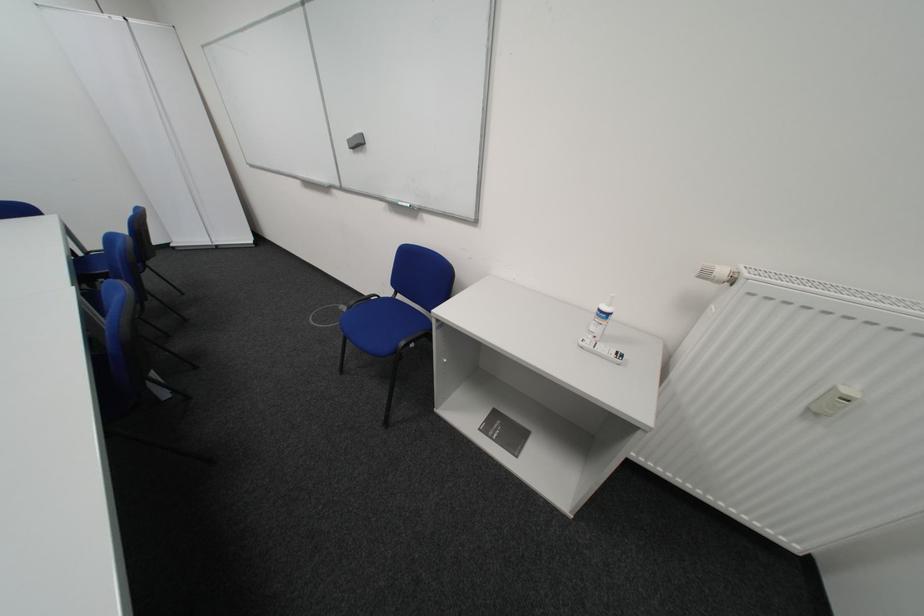
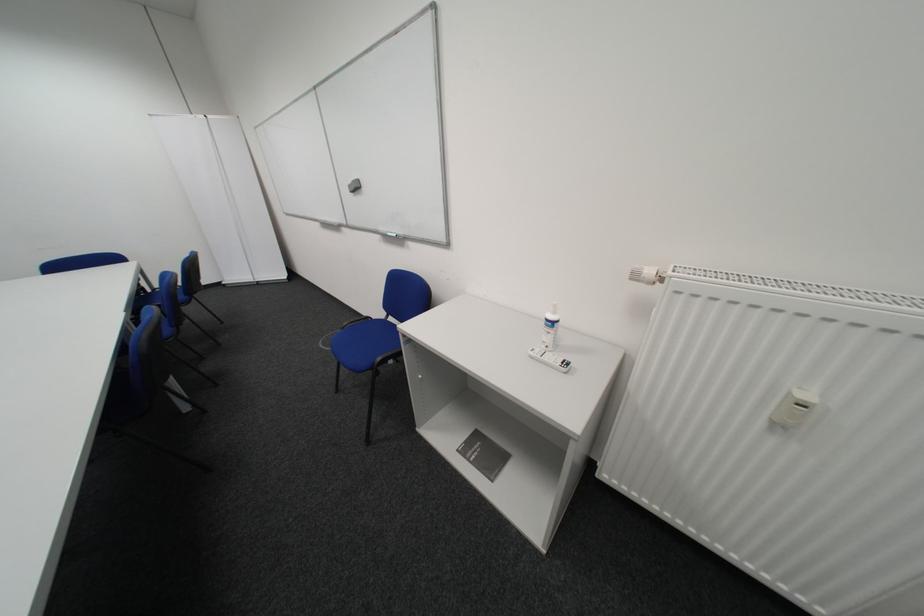
Question: The images are taken continuously from a first-person perspective. In which direction is your viewpoint rotating?

Choices:
 (A) Left
 (B) Right
 (C) Up
 (D) Down

Answer: (C)